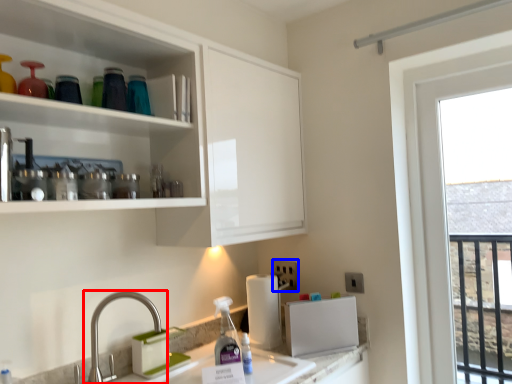
Question: Which point is closer to the camera, tap (highlighted by a red box) or electric outlet (highlighted by a blue box)?

Choices:
 (A) tap
 (B) electric outlet

Answer: (A)